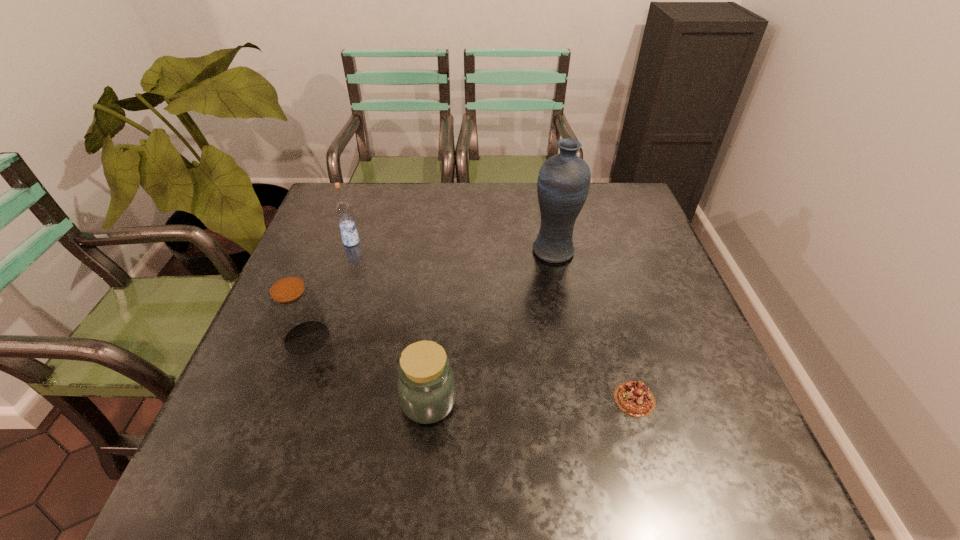
This screenshot has width=960, height=540. What are the coordinates of `object identified as the fourth closest to the chocolate cake` in the screenshot? It's located at (343, 210).

Select which object appears as the fourth closest to the third farthest object. Please provide its 2D coordinates. Your answer should be formatted as a tuple, i.e. [(x, y)], where the tuple contains the x and y coordinates of a point satisfying the conditions above.

[(634, 398)]

Where is `vacant position in the image that satisfies the following two spatial constraints: 1. on the back side of the shortest object; 2. on the right side of the right jar`? vacant position in the image that satisfies the following two spatial constraints: 1. on the back side of the shortest object; 2. on the right side of the right jar is located at coordinates (429, 399).

This screenshot has height=540, width=960. I want to click on free location that satisfies the following two spatial constraints: 1. on the front side of the vase; 2. on the right side of the chocolate cake, so click(x=583, y=399).

You are a GUI agent. You are given a task and a screenshot of the screen. Output one action in this format:
    pyautogui.click(x=<x>, y=<y>)
    Task: Click on the vacant space that satisfies the following two spatial constraints: 1. on the front side of the shortest object; 2. on the left side of the vase
    Image resolution: width=960 pixels, height=540 pixels.
    Given the screenshot: What is the action you would take?
    pyautogui.click(x=583, y=399)